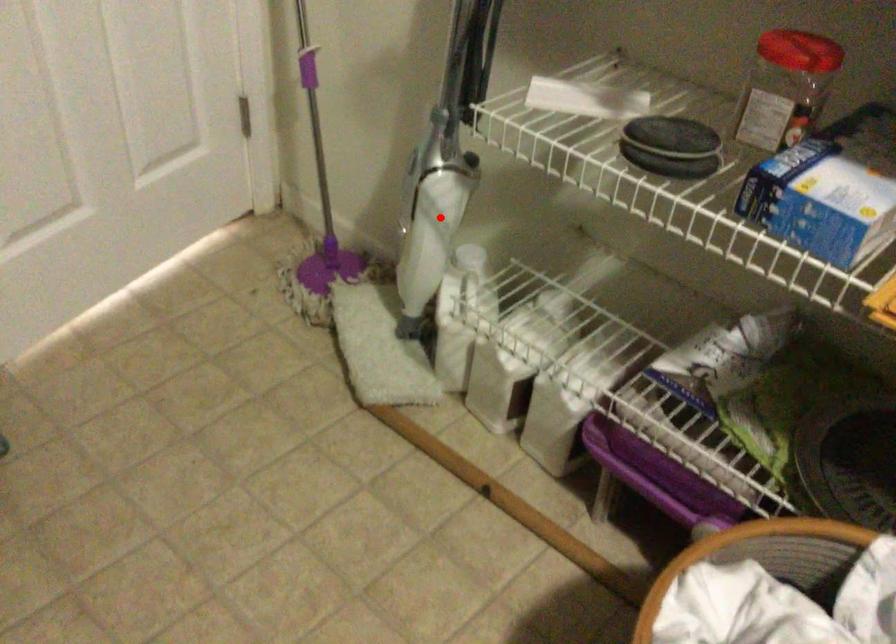
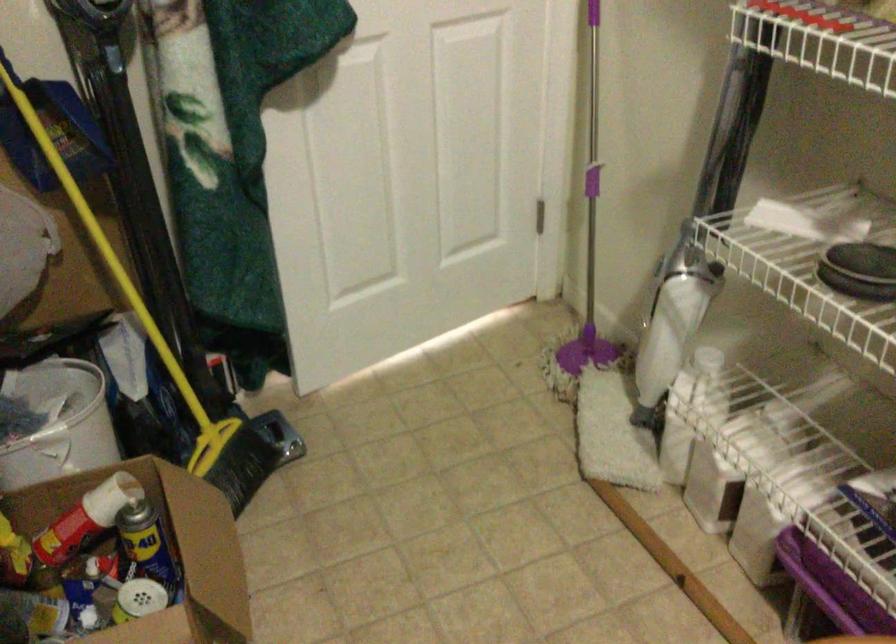
The point at the highlighted location is marked in the first image. Where is the corresponding point in the second image?

(674, 317)